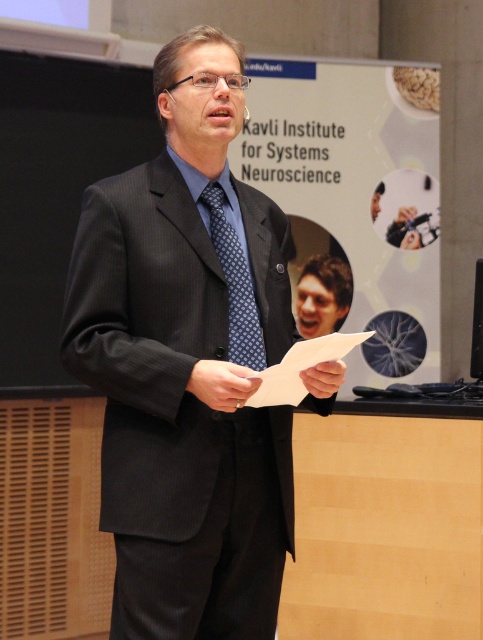
Can you confirm if blue dotted tie at center is taller than brown hair at center?

Correct, blue dotted tie at center is much taller as brown hair at center.

Which of these two, blue dotted tie at center or brown hair at center, stands shorter?

Standing shorter between the two is brown hair at center.

This screenshot has height=640, width=483. In order to click on blue dotted tie at center in this screenshot , I will do `click(235, 284)`.

Identify the location of blue dotted tie at center. The height and width of the screenshot is (640, 483). (235, 284).

Is point (229, 392) positioned before point (204, 188)?

Yes.

Who is more forward, (208, 145) or (263, 364)?

Point (208, 145)

Locate an element on the screen. black pinstripe suit at center is located at coordinates pyautogui.click(x=201, y=124).

Is black pinstripe suit at center to the right of brown hair at center from the viewer's perspective?

No, black pinstripe suit at center is not to the right of brown hair at center.

Image resolution: width=483 pixels, height=640 pixels. What do you see at coordinates (201, 124) in the screenshot? I see `black pinstripe suit at center` at bounding box center [201, 124].

Is point (184, 104) positioned in front of point (345, 308)?

Yes, point (184, 104) is in front of point (345, 308).

Locate an element on the screen. This screenshot has height=640, width=483. black pinstripe suit at center is located at coordinates (201, 124).